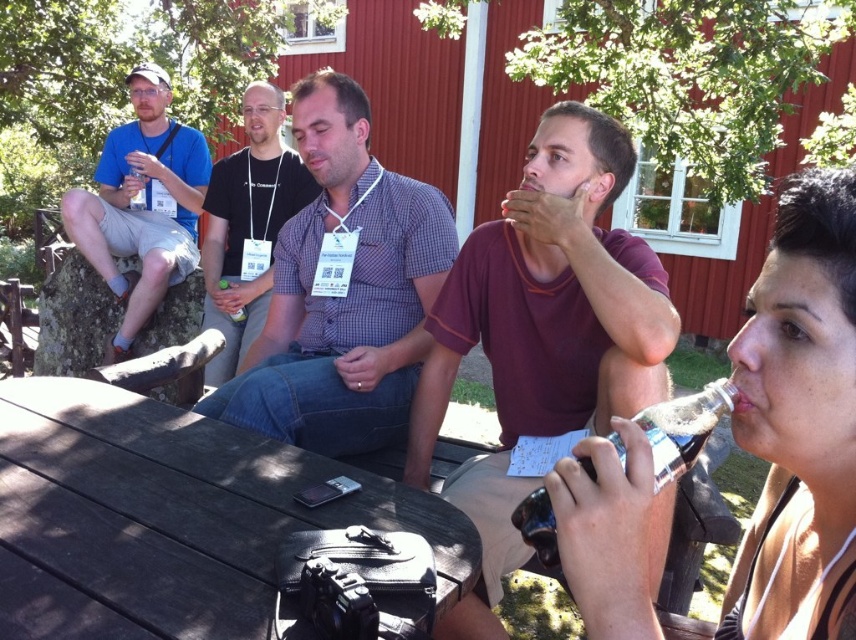
Is maroon cotton shirt at center above matte blue shirt at left?

No.

Is point (492, 477) less distant than point (191, 189)?

That is True.

Is point (471, 602) positioned in front of point (116, 337)?

Yes.

This screenshot has width=856, height=640. I want to click on maroon cotton shirt at center, so click(x=544, y=332).

Does point (357, 445) come in front of point (726, 397)?

No, it is behind (726, 397).

Which of these two, checkered fabric shirt at center or clear plastic bottle at lower right, stands shorter?

Standing shorter between the two is clear plastic bottle at lower right.

This screenshot has width=856, height=640. In order to click on checkered fabric shirt at center in this screenshot , I will do `click(342, 291)`.

Find the location of a particular element. Image resolution: width=856 pixels, height=640 pixels. checkered fabric shirt at center is located at coordinates (342, 291).

Can you confirm if maroon cotton shirt at center is smaller than clear plastic bottle at lower right?

No, maroon cotton shirt at center is not smaller than clear plastic bottle at lower right.

Which is in front, point (443, 497) or point (587, 470)?

Point (587, 470) is more forward.

What are the coordinates of `maroon cotton shirt at center` in the screenshot? It's located at (544, 332).